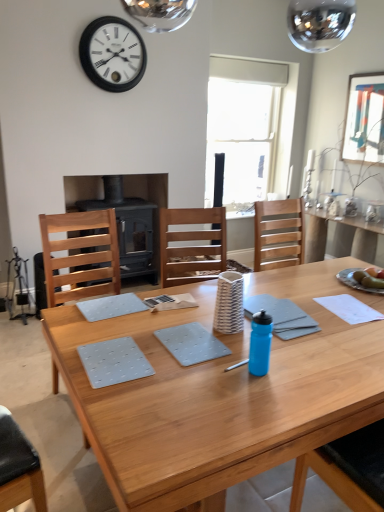
You are a GUI agent. You are given a task and a screenshot of the screen. Output one action in this format:
    pyautogui.click(x=<x>, y=<y>)
    Task: Click on the free space above gray matte placemat at center, which is counted as the 1th place mat, starting from the bottom (from a real-world perspective)
    The width and height of the screenshot is (384, 512).
    Given the screenshot: What is the action you would take?
    pyautogui.click(x=113, y=357)